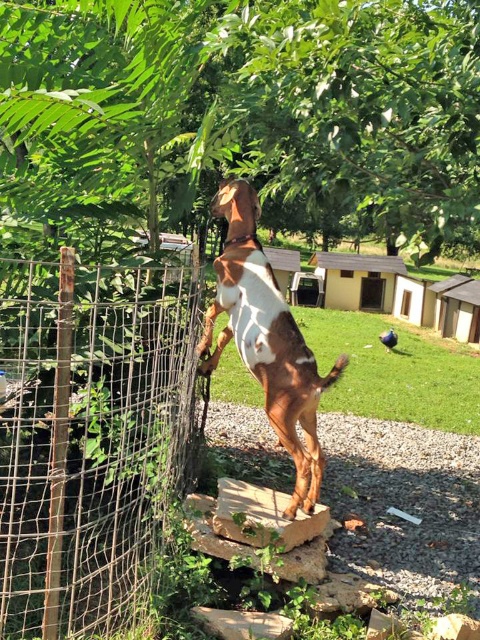
Question: Considering the relative positions of wire mesh fence at center and brown glossy dog at center in the image provided, where is wire mesh fence at center located with respect to brown glossy dog at center?

Choices:
 (A) left
 (B) right

Answer: (A)

Question: Is wire mesh fence at center positioned behind brown glossy dog at center?

Choices:
 (A) no
 (B) yes

Answer: (A)

Question: Which of the following is the farthest from the observer?

Choices:
 (A) (232, 333)
 (B) (31, 401)

Answer: (A)

Question: Can you confirm if wire mesh fence at center is positioned to the left of brown glossy dog at center?

Choices:
 (A) no
 (B) yes

Answer: (B)

Question: Which of the following is the closest to the observer?

Choices:
 (A) brown glossy dog at center
 (B) wire mesh fence at center

Answer: (B)